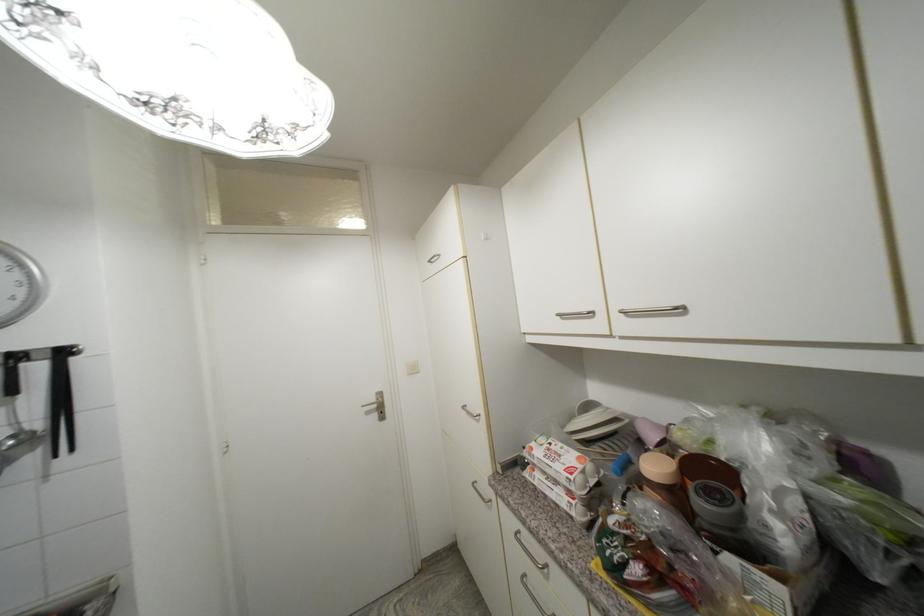
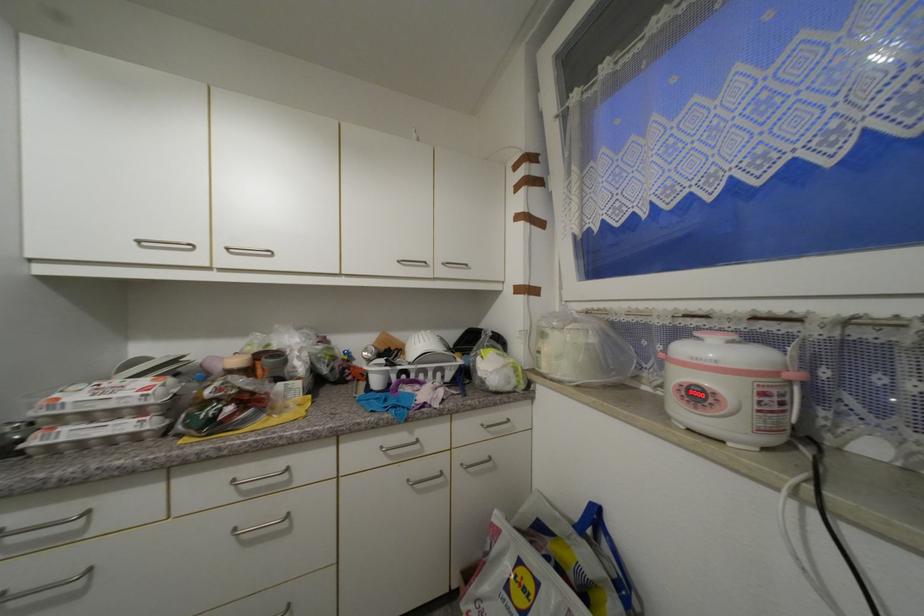
Question: The camera is either moving clockwise (left) or counter-clockwise (right) around the object. The first image is from the beginning of the video and the second image is from the end. Is the camera moving left or right when shooting the video?

Choices:
 (A) Left
 (B) Right

Answer: (A)